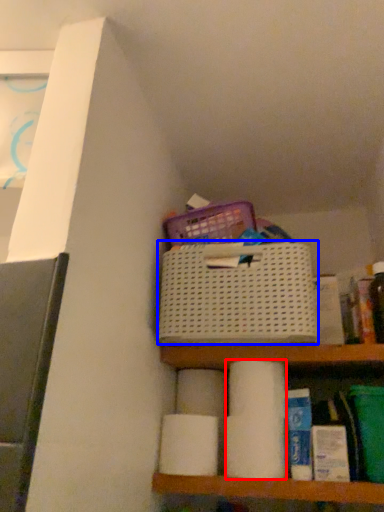
Question: Which object appears farthest to the camera in this image, toilet paper (highlighted by a red box) or basket (highlighted by a blue box)?

Choices:
 (A) toilet paper
 (B) basket

Answer: (A)